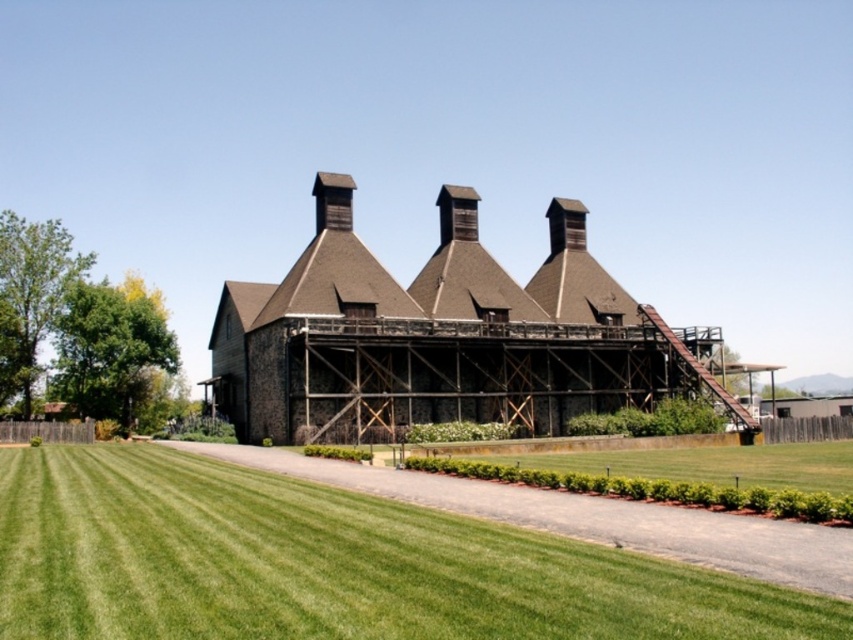
Question: Observing the image, what is the correct spatial positioning of green grass at lower left in reference to brown wooden building at center?

Choices:
 (A) right
 (B) left

Answer: (B)

Question: Is green grass at lower left to the right of brown wooden building at center from the viewer's perspective?

Choices:
 (A) no
 (B) yes

Answer: (A)

Question: Is green grass at lower left behind brown wooden building at center?

Choices:
 (A) yes
 (B) no

Answer: (B)

Question: Which object appears farthest from the camera in this image?

Choices:
 (A) green grass at lower left
 (B) brown wooden building at center

Answer: (B)

Question: Which point is closer to the camera taking this photo?

Choices:
 (A) (90, 484)
 (B) (566, 380)

Answer: (A)

Question: Which point appears closest to the camera in this image?

Choices:
 (A) (572, 388)
 (B) (80, 512)

Answer: (B)